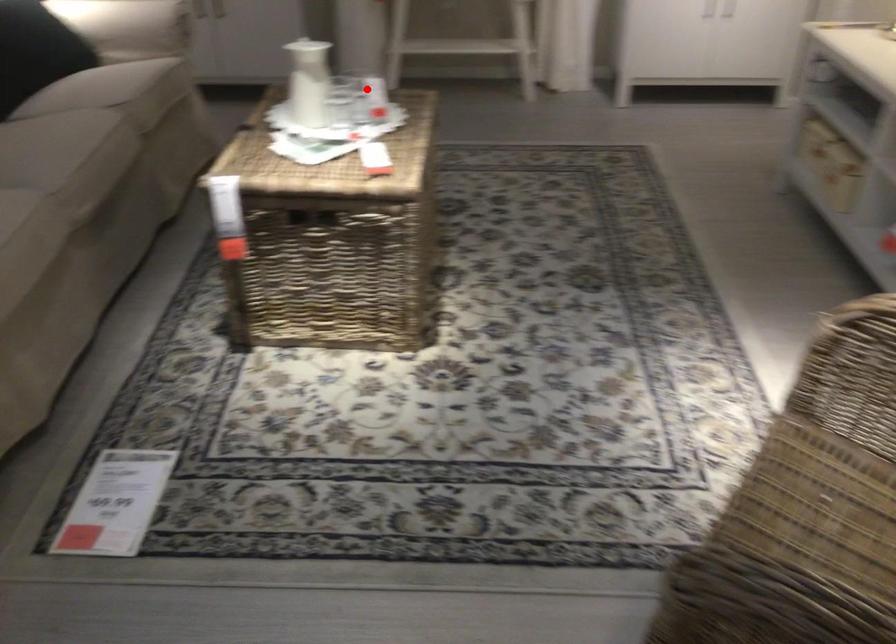
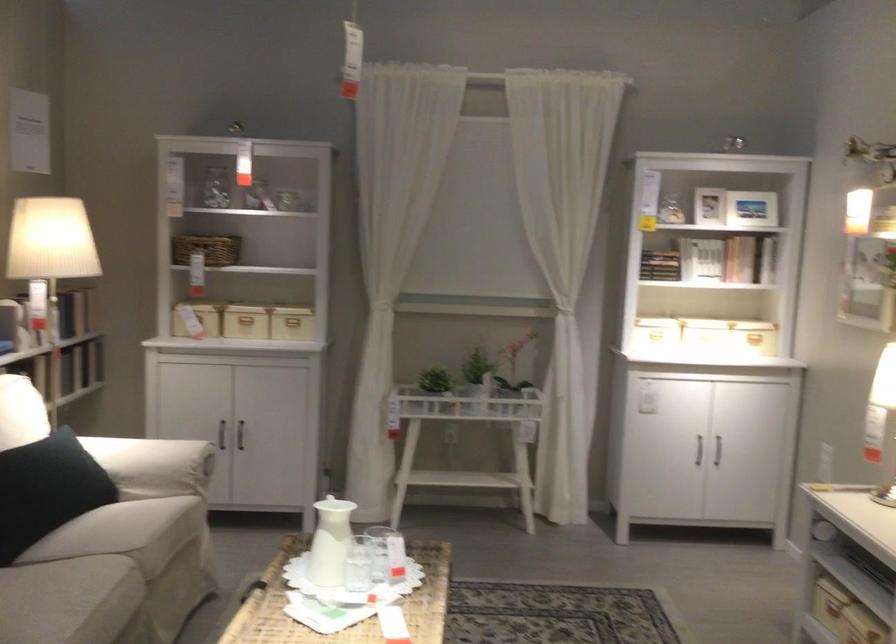
Find the pixel in the second image that matches the highlighted location in the first image.

(386, 554)